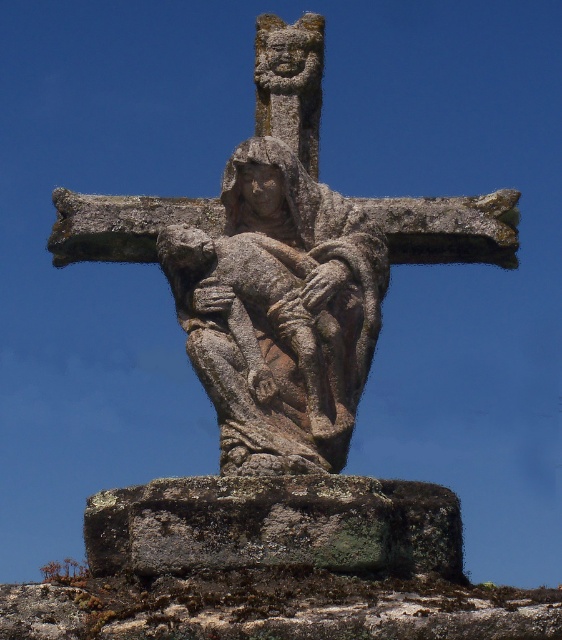
Is point (357, 400) closer to viewer compared to point (384, 493)?

No.

Where is `rough stone sculpture at center`? The height and width of the screenshot is (640, 562). rough stone sculpture at center is located at coordinates (283, 266).